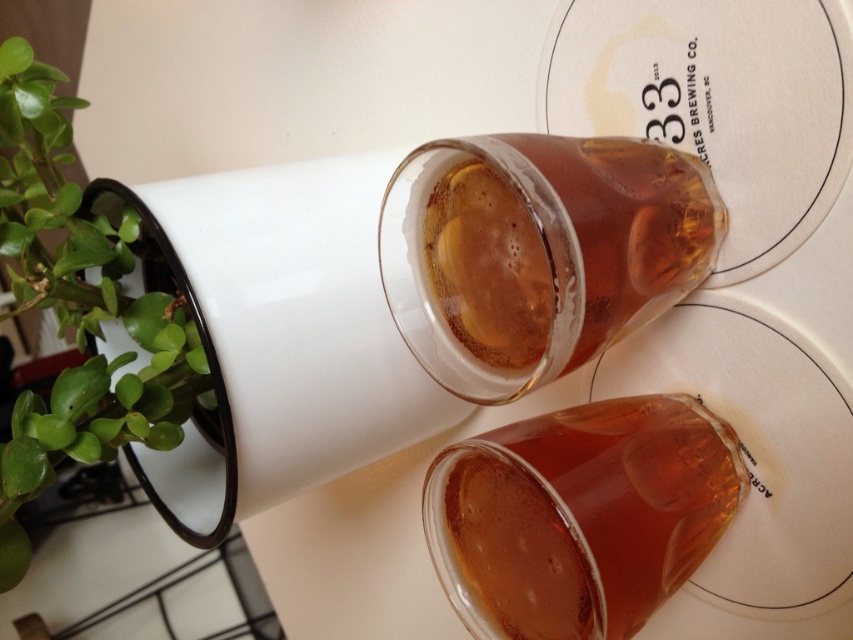
Measure the distance between translucent amber liquid at center and camera.

translucent amber liquid at center is 23.57 inches away from camera.

How much distance is there between translucent amber liquid at center and green leafy plant at left?

They are 17.38 inches apart.

Between point (564, 419) and point (177, 435), which one is positioned behind?

The point (177, 435) is more distant.

Where is `translucent amber liquid at center`? The height and width of the screenshot is (640, 853). translucent amber liquid at center is located at coordinates (579, 515).

Is point (585, 188) more distant than point (77, 285)?

That is False.

Does translucent amber glass at center appear over green leafy plant at left?

Yes, translucent amber glass at center is above green leafy plant at left.

The height and width of the screenshot is (640, 853). Describe the element at coordinates (538, 252) in the screenshot. I see `translucent amber glass at center` at that location.

At what (x,y) coordinates should I click in order to perform the action: click on translucent amber glass at center. Please return your answer as a coordinate pair (x, y). Looking at the image, I should click on (538, 252).

Which is behind, point (614, 323) or point (666, 416)?

Point (666, 416)

The image size is (853, 640). Find the location of `translucent amber glass at center`. translucent amber glass at center is located at coordinates (538, 252).